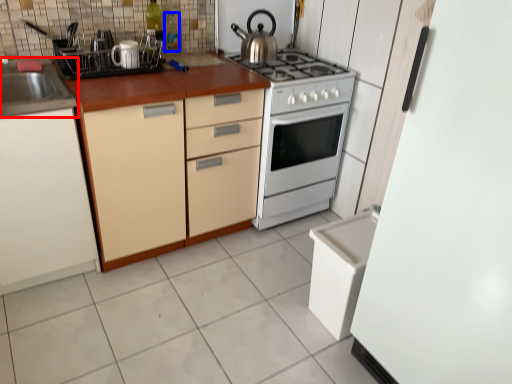
Question: Which point is closer to the camera, sink (highlighted by a red box) or bottle (highlighted by a blue box)?

Choices:
 (A) sink
 (B) bottle

Answer: (A)